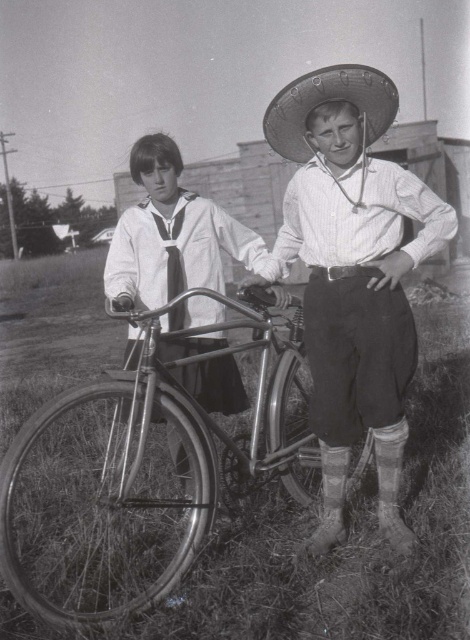
Question: Which object is farther from the camera taking this photo?

Choices:
 (A) woven straw sombrero at center
 (B) shiny chrome bicycle at center
 (C) smooth fabric sailor suit at center
 (D) white striped shirt at center

Answer: (C)

Question: Which point is farther to the camera?

Choices:
 (A) [x=67, y=614]
 (B) [x=394, y=113]

Answer: (B)

Question: Can you confirm if shiny chrome bicycle at center is wider than woven straw sombrero at center?

Choices:
 (A) yes
 (B) no

Answer: (A)

Question: Is smooth fabric sailor suit at center closer to the viewer compared to woven straw sombrero at center?

Choices:
 (A) no
 (B) yes

Answer: (A)

Question: Which object is closer to the camera taking this photo?

Choices:
 (A) woven straw sombrero at center
 (B) smooth fabric sailor suit at center
 (C) shiny chrome bicycle at center
 (D) satin necktie at center

Answer: (C)

Question: In this image, where is white striped shirt at center located relative to satin necktie at center?

Choices:
 (A) left
 (B) right

Answer: (B)